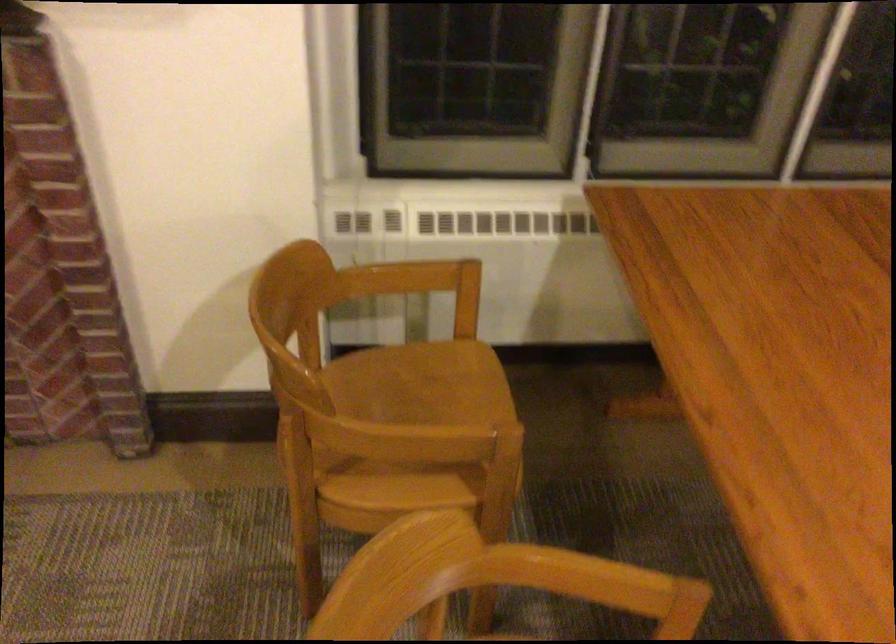
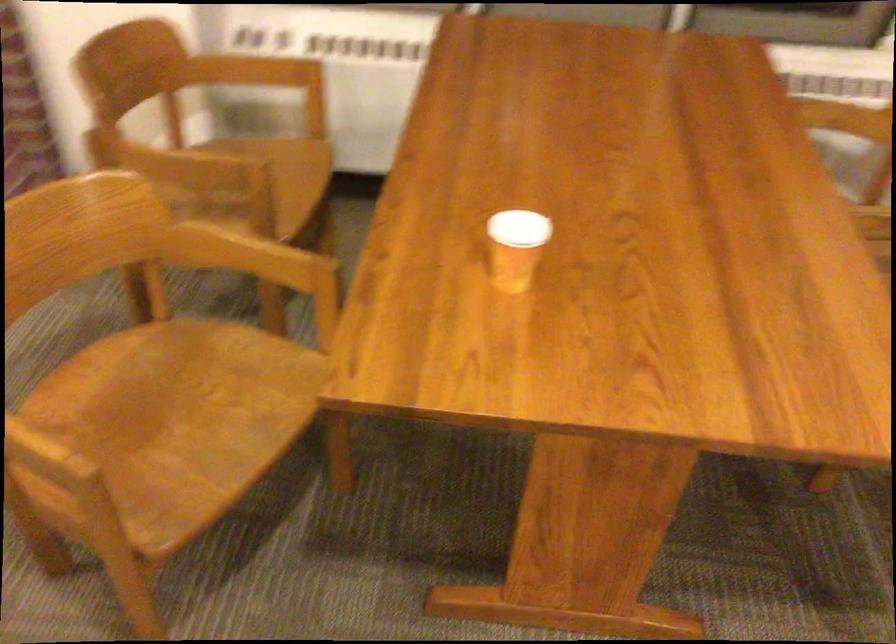
The point at (409, 437) is marked in the first image. Where is the corresponding point in the second image?

(169, 163)